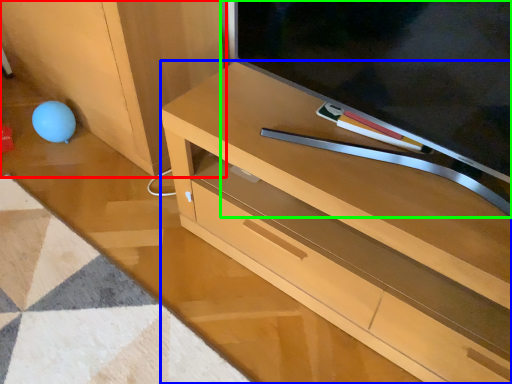
Question: Which object is the closest to the cabinetry (highlighted by a red box)? Choose among these: desk (highlighted by a blue box) or television (highlighted by a green box).

Choices:
 (A) desk
 (B) television

Answer: (A)